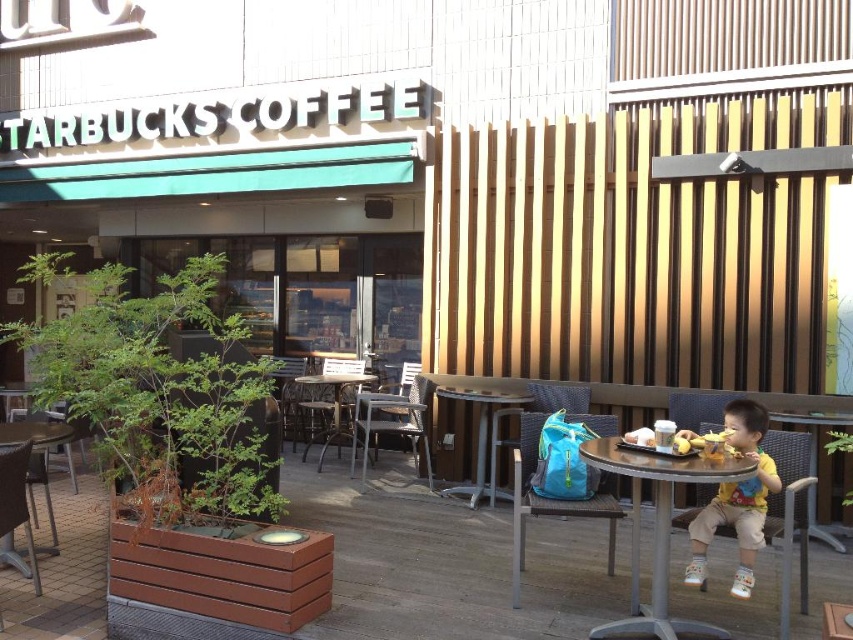
Question: Considering the real-world distances, which object is closest to the rattan chair at left?

Choices:
 (A) wooden table at lower left
 (B) blue fabric backpack at center
 (C) matte brown table at center

Answer: (A)

Question: Among these objects, which one is farthest from the camera?

Choices:
 (A) metallic silver table at lower right
 (B) yellow cotton shirt at lower right
 (C) metallic silver table at center
 (D) blue fabric backpack at center

Answer: (C)

Question: Does metallic silver table at lower right appear under metallic silver table at center?

Choices:
 (A) no
 (B) yes

Answer: (B)

Question: Estimate the real-world distances between objects in this image. Which object is closer to the matte brown table at center?

Choices:
 (A) metallic silver table at center
 (B) blue fabric backpack at center

Answer: (B)

Question: Where is rattan chair at left located in relation to wooden table at lower left in the image?

Choices:
 (A) left
 (B) right

Answer: (B)

Question: Does metallic silver table at lower right have a smaller size compared to matte brown chair at center?

Choices:
 (A) yes
 (B) no

Answer: (A)